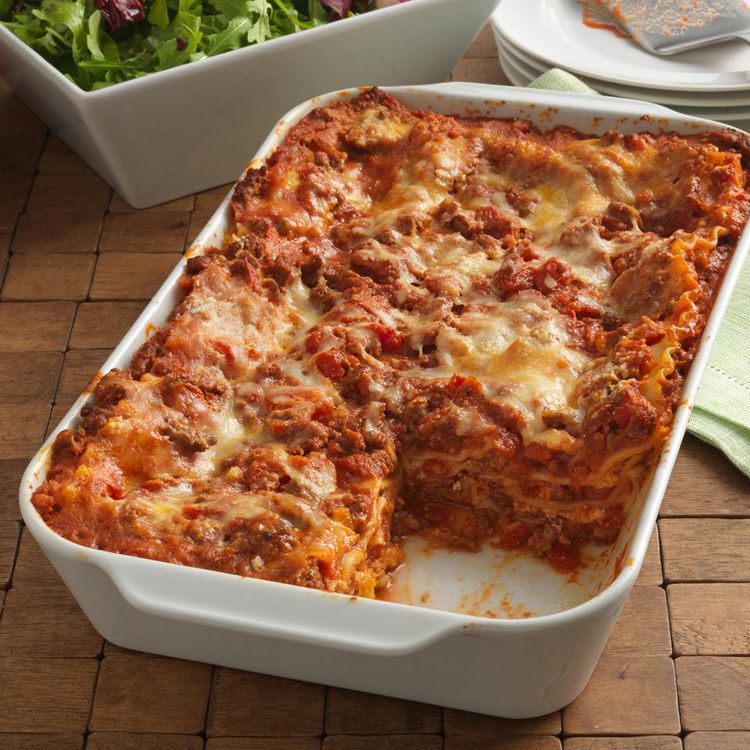
Locate an element on the screen. This screenshot has width=750, height=750. baking dish is located at coordinates (471, 682).